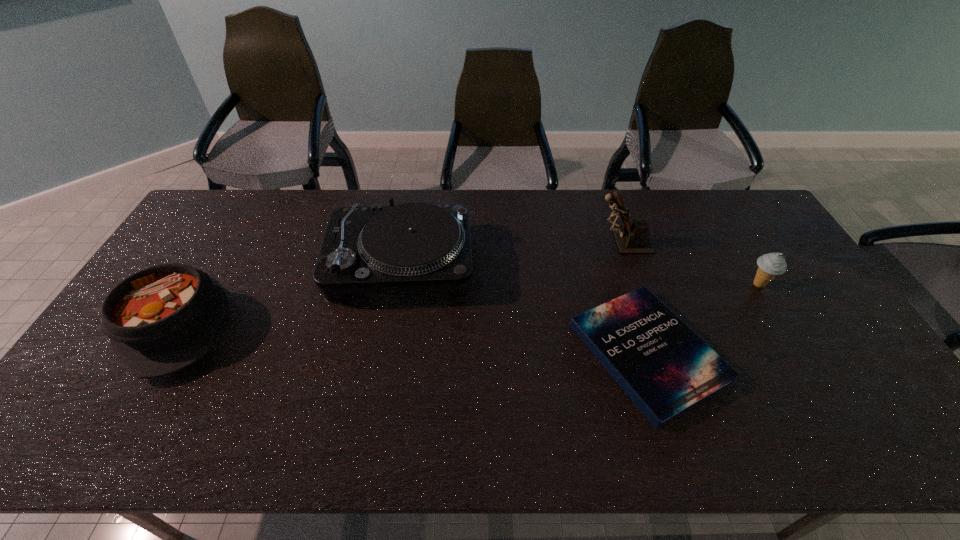
Identify the location of figurine. The width and height of the screenshot is (960, 540). (632, 237).

I want to click on record player, so click(413, 246).

Locate an element on the screen. the rightmost object is located at coordinates (771, 264).

Locate an element on the screen. This screenshot has width=960, height=540. the leftmost object is located at coordinates (164, 318).

Locate an element on the screen. This screenshot has height=540, width=960. the shortest object is located at coordinates (666, 369).

Find the location of a particular element. The width and height of the screenshot is (960, 540). vacant space located on the front-facing side of the tallest object is located at coordinates (514, 242).

I want to click on vacant space located 0.280m on the front-facing side of the tallest object, so click(x=510, y=242).

Locate an element on the screen. Image resolution: width=960 pixels, height=540 pixels. vacant area situated on the front-facing side of the tallest object is located at coordinates (567, 242).

This screenshot has width=960, height=540. In order to click on blank area located 0.140m on the front of the second object from left to right in this screenshot , I will do `click(386, 347)`.

This screenshot has width=960, height=540. I want to click on free point located on the front of the icecream, so click(773, 307).